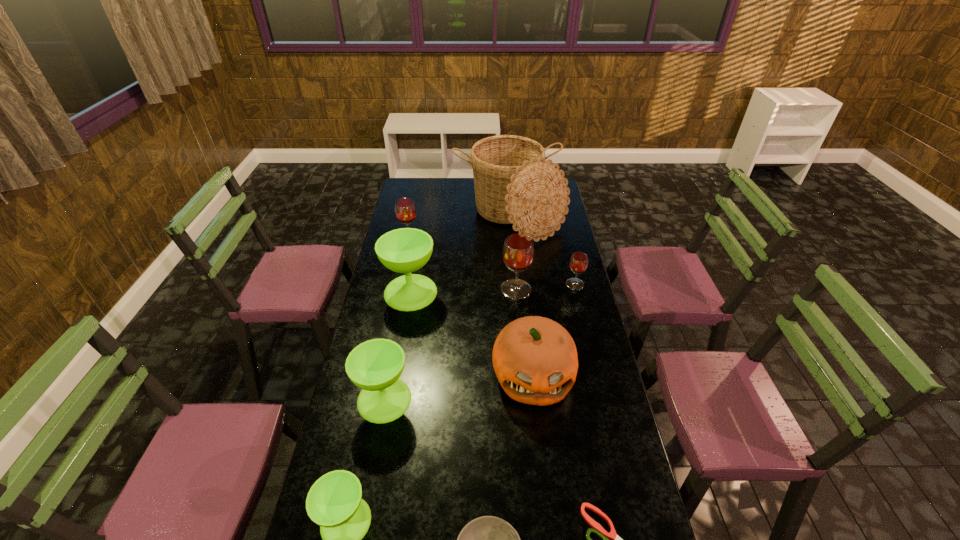
The width and height of the screenshot is (960, 540). What are the coordinates of `basket` in the screenshot? It's located at (514, 184).

Where is `the second red wineglass from left to right`? The height and width of the screenshot is (540, 960). the second red wineglass from left to right is located at coordinates (518, 252).

Image resolution: width=960 pixels, height=540 pixels. Identify the location of the second wineglass from right to left. (518, 252).

The image size is (960, 540). What are the coordinates of `the farthest green wineglass` in the screenshot? It's located at (405, 250).

The height and width of the screenshot is (540, 960). Find the location of `pumpkin`. pumpkin is located at coordinates (535, 359).

The image size is (960, 540). What are the coordinates of `the farthest red wineglass` in the screenshot? It's located at (405, 210).

Locate an element on the screen. Image resolution: width=960 pixels, height=540 pixels. the farthest wineglass is located at coordinates (405, 210).

The height and width of the screenshot is (540, 960). Identify the location of the second farthest green wineglass. (375, 366).

Identify the location of the second biggest green wineglass. (375, 366).

Identify the location of the rightmost wineglass. This screenshot has height=540, width=960. (578, 263).